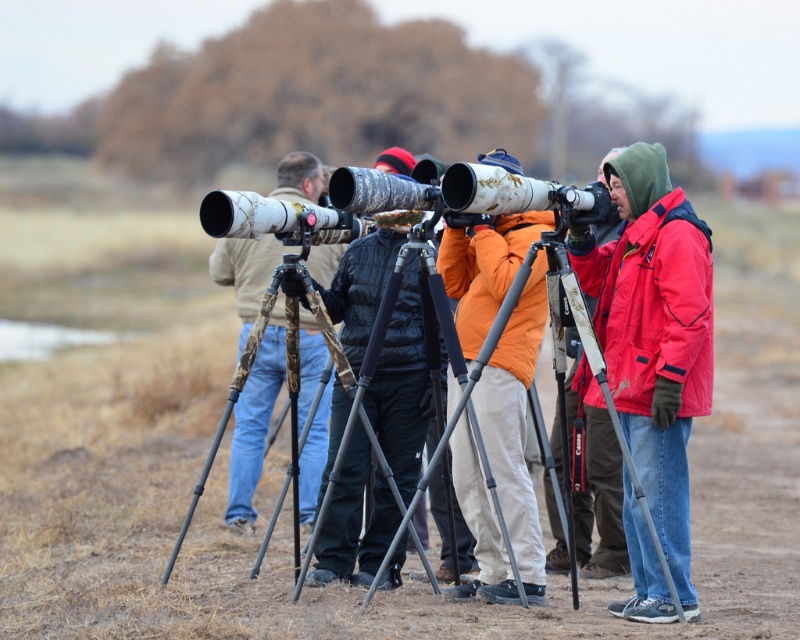
You are standing at the edge of the field and see the red matte jacket at right and the orange fleece jacket at center. If you want to approach both people wearing these jackets, which one should you move towards first to reach them in the shortest distance?

The orange fleece jacket at center is closer to you than the red matte jacket at right, so you should move towards the orange fleece jacket at center first to minimize the distance traveled.

You are standing in the open field and want to approach the matte black jacket at right. Do you need to walk around the camouflage tripod at center first?

Yes, you need to walk around the camouflage tripod at center first because it is closer to you than the matte black jacket at right, blocking your direct path.

You are a photographer trying to capture a group photo of the red matte jacket at right and the orange fleece jacket at center. Which person should you focus on first if you want to ensure both are in frame without moving the camera?

You should focus on the red matte jacket at right first because it is bigger than the orange fleece jacket at center, so it will be easier to frame them both without moving the camera.